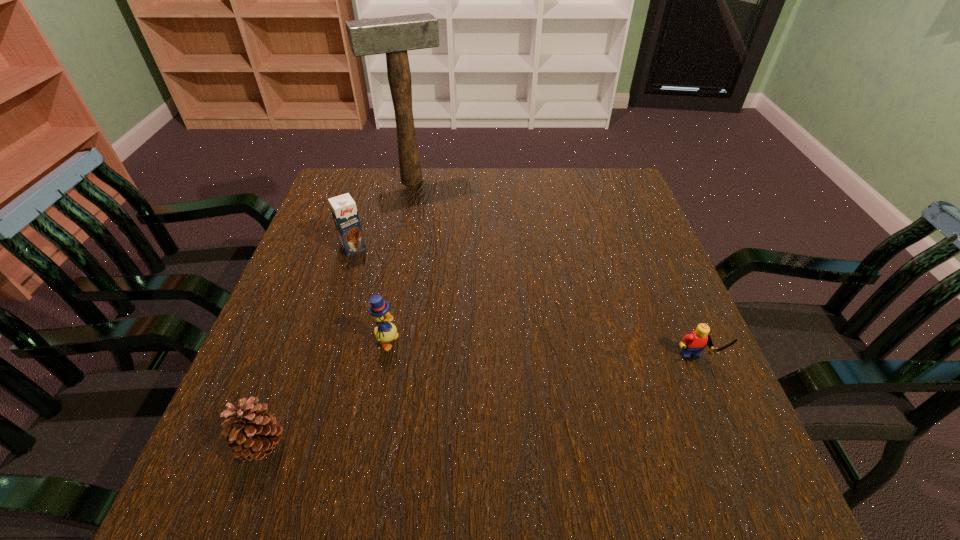
The height and width of the screenshot is (540, 960). What are the coordinates of `free space located 0.260m on the front label of the fourth shortest object` in the screenshot? It's located at (400, 324).

This screenshot has width=960, height=540. Identify the location of free space located 0.350m on the face of the duckling, where the monocle is placed. (566, 397).

I want to click on free region located on the face of the duckling, where the monocle is placed, so pos(577,400).

You are a GUI agent. You are given a task and a screenshot of the screen. Output one action in this format:
    pyautogui.click(x=<x>, y=<y>)
    Task: Click on the free spot located 0.390m on the face of the duckling, where the monocle is placed
    The width and height of the screenshot is (960, 540).
    Given the screenshot: What is the action you would take?
    pyautogui.click(x=588, y=403)

Locate an element on the screen. The height and width of the screenshot is (540, 960). vacant area located 0.390m on the striking surface of the mallet is located at coordinates (468, 276).

What are the coordinates of `free space located on the striking surface of the mallet` in the screenshot? It's located at (428, 202).

Where is `vacant region located 0.190m on the striking surface of the mallet`? The width and height of the screenshot is (960, 540). vacant region located 0.190m on the striking surface of the mallet is located at coordinates (442, 228).

This screenshot has width=960, height=540. In order to click on object that is at the far edge in this screenshot , I will do `click(396, 35)`.

The image size is (960, 540). What are the coordinates of `object situated at the near edge` in the screenshot? It's located at (252, 434).

At what (x,y) coordinates should I click in order to perform the action: click on pinecone that is positioned at the left edge. Please return your answer as a coordinate pair (x, y). Looking at the image, I should click on (252, 434).